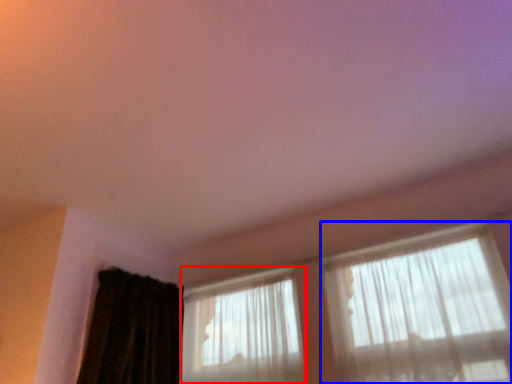
Question: Among these objects, which one is nearest to the camera, window (highlighted by a red box) or window (highlighted by a blue box)?

Choices:
 (A) window
 (B) window

Answer: (B)